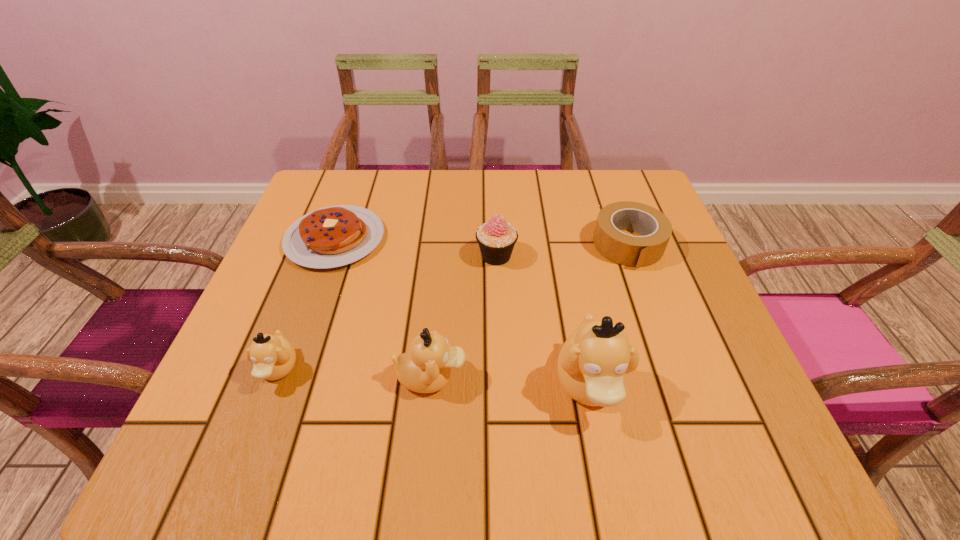
Locate an element on the screen. The image size is (960, 540). vacant spot to place a duckling on the right is located at coordinates (752, 393).